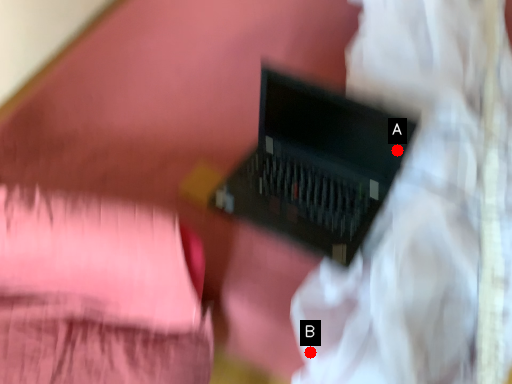
Question: Two points are circled on the image, labeled by A and B beside each circle. Which point appears farthest from the camera in this image?

Choices:
 (A) A is further
 (B) B is further

Answer: (A)